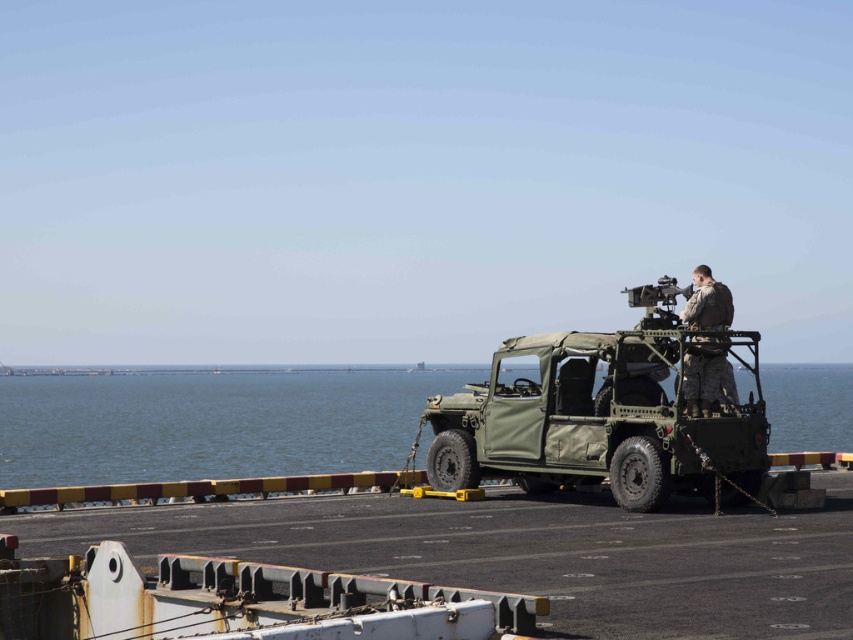
Question: Among these objects, which one is nearest to the camera?

Choices:
 (A) green matte jeep at center
 (B) green matte water at center

Answer: (A)

Question: Where is green matte water at center located in relation to camouflage fabric uniform at center in the image?

Choices:
 (A) right
 (B) left

Answer: (B)

Question: Which of the following is the closest to the observer?

Choices:
 (A) (334, 380)
 (B) (703, 272)

Answer: (B)

Question: Which point is farther to the camera?

Choices:
 (A) (721, 308)
 (B) (440, 476)
 (C) (134, 374)

Answer: (C)

Question: Is green matte jeep at center smaller than camouflage fabric uniform at center?

Choices:
 (A) no
 (B) yes

Answer: (A)

Question: Does green matte water at center appear over green matte jeep at center?

Choices:
 (A) no
 (B) yes

Answer: (A)